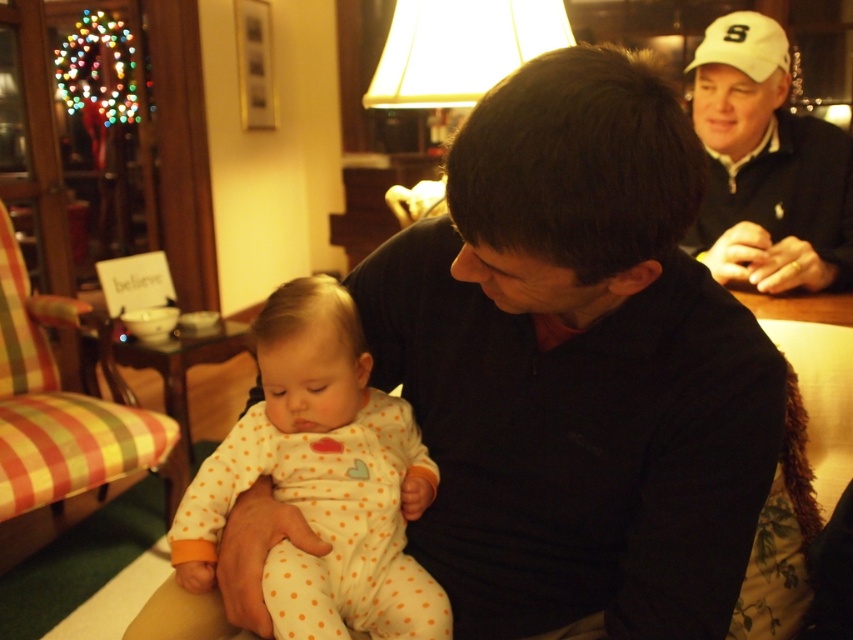
You are a photographer setting up for a family photo. You need to position a light source to the right of the white polka dot onesie at center and to the left of the white matte cap at upper right. Is this possible based on their current positions?

The white polka dot onesie at center is to the left of the white matte cap at upper right, so placing the light source to the right of the white polka dot onesie at center and to the left of the white matte cap at upper right is possible as it can be positioned between them.

Based on the photo, you are a photographer holding a camera. You want to take a photo of the matte black shirt at center without moving the camera. Can you do it?

The matte black shirt at center and camera are 22.11 inches apart from each other, so yes, you can take a photo of the matte black shirt at center without moving the camera as the distance is sufficient for a clear shot.

From the picture: You are a photographer trying to capture a candid shot of both the matte black shirt at center and the white matte baseball cap at upper right. Since you want to ensure both subjects are in focus, you need to know their height relationship. Which object is taller?

The matte black shirt at center is much taller than the white matte baseball cap at upper right, so you should adjust your camera settings to accommodate the height difference for better focus.